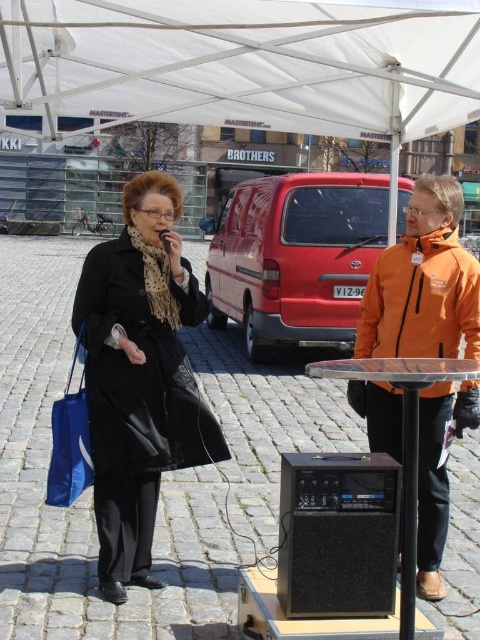
You are standing at the point with coordinates point (166, 225) and want to move towards the point with coordinates point (167, 241). Is the point you want to reach in front of or behind you?

The point (167, 241) is in front of you because the point (166, 225) is behind point (167, 241).

You are attending an event under a white canopy tent and notice the black leather coat at center and the matte black microphone at center. From your perspective, which object is positioned lower in the scene?

The black leather coat at center is located below the matte black microphone at center, so the black leather coat at center is positioned lower in the scene.